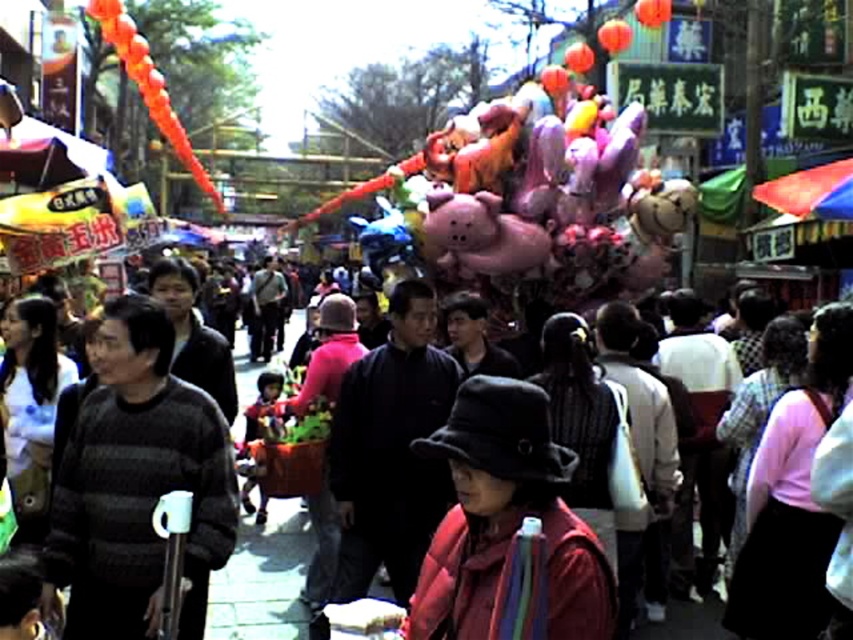
Is striped sweater at center wider than dark gray sweater at center?

In fact, striped sweater at center might be narrower than dark gray sweater at center.

Who is positioned more to the left, striped sweater at center or dark gray sweater at center?

dark gray sweater at center is more to the left.

Find the location of a particular element. This screenshot has height=640, width=853. striped sweater at center is located at coordinates (137, 484).